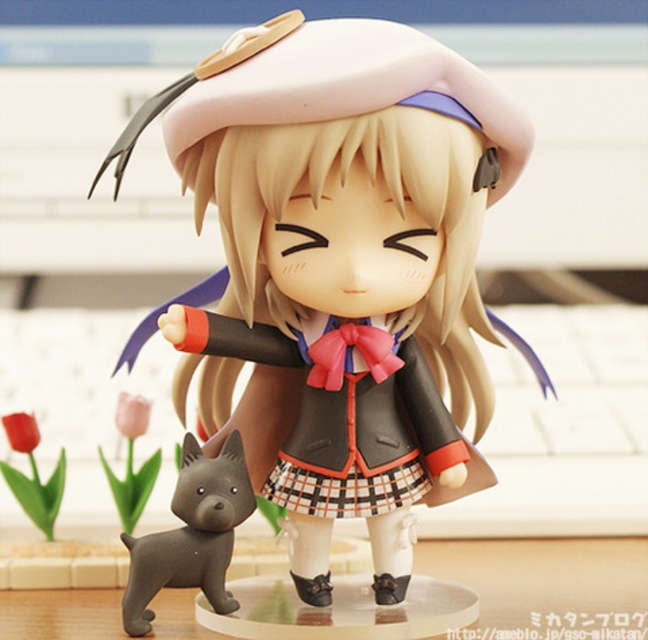
You are trying to decide which item to place in a small gift box that can only fit items up to the size of the smooth gray dog at lower left. Based on the scene, will the plaid fabric dress at center fit inside the box?

The plaid fabric dress at center is bigger than the smooth gray dog at lower left, so it will not fit inside the gift box designed for items up to the dog size.

You are a collector organizing a display shelf. You have the matte black doll at center and the smooth gray dog at lower left. Which object should you place on the left side of the shelf to maintain the original arrangement?

The smooth gray dog at lower left should be placed on the left side of the shelf because in the original arrangement, the matte black doll at center is positioned on the right side of the smooth gray dog at lower left.

You are a collector who wants to place a new figurine on a shelf that can only accommodate items up to 3 inches wide. The plaid fabric dress at center and smooth gray dog at lower left are part of the same figurine. Can this figurine fit on the shelf?

The plaid fabric dress at center and smooth gray dog at lower left are 2.91 inches apart, so the total width of the figurine is within the 3 inches limit. Therefore, the figurine can fit on the shelf.